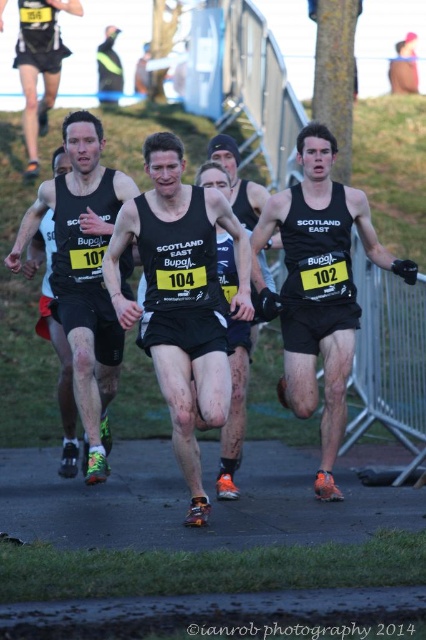
You are a photographer trying to capture a clear shot of the black matte tank top at center and the matte black tank top at upper left. Which runner should you focus on first to ensure they are in the foreground of your photo?

The black matte tank top at center is in front of the matte black tank top at upper left, so you should focus on the black matte tank top at center first to ensure it appears in the foreground of your photo.

You are a photographer standing at the starting line of the race. You want to capture a photo of the runner wearing the matte black shorts at center and the matte black singlet at center. Based on their positions, which clothing item will appear closer to the top of the photo?

The matte black shorts at center will appear closer to the top of the photo because it is taller than the matte black singlet at center.

You are a photographer standing at the starting line of the race. You want to take a photo that includes both the point at (65, 272) and the point at (233, 292). Which point should you focus on first to ensure both are in clear view?

You should focus on point (65, 272) first because it is closer to you than point (233, 292), ensuring both points are in clear view when focused on the closer one.